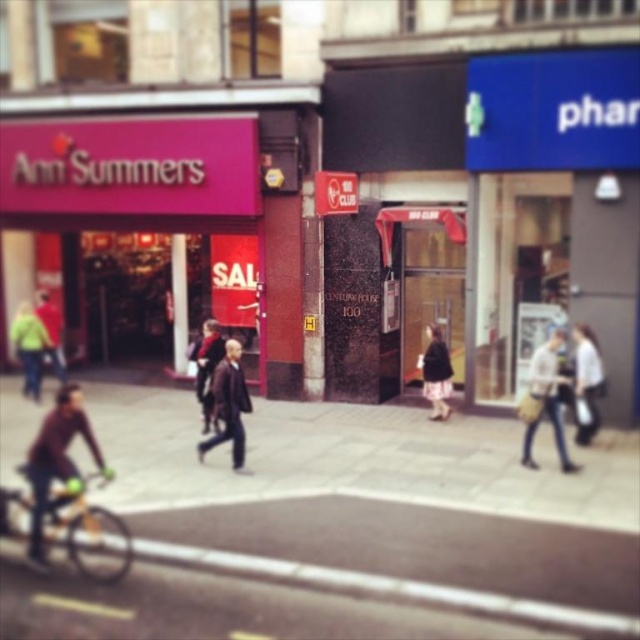
Which is more to the right, smooth concrete pavement at center or green fabric jacket at left?

From the viewer's perspective, smooth concrete pavement at center appears more on the right side.

Who is more forward, (56,616) or (35,328)?

Point (56,616) is more forward.

Is point (497, 577) positioned after point (24, 314)?

No, (497, 577) is closer to viewer.

Where is `smooth concrete pavement at center`? The image size is (640, 640). smooth concrete pavement at center is located at coordinates (346, 529).

Can you confirm if matte brown jacket at lower left is wider than white fabric bag at center?

Correct, the width of matte brown jacket at lower left exceeds that of white fabric bag at center.

Describe the element at coordinates (58, 460) in the screenshot. I see `matte brown jacket at lower left` at that location.

You are a GUI agent. You are given a task and a screenshot of the screen. Output one action in this format:
    pyautogui.click(x=<x>, y=<y>)
    Task: Click on the matte brown jacket at lower left
    Image resolution: width=640 pixels, height=640 pixels.
    Given the screenshot: What is the action you would take?
    pyautogui.click(x=58, y=460)

Which is more to the right, white fabric bag at center or matte black jacket at center?

Positioned to the right is white fabric bag at center.

Which is below, white fabric bag at center or matte black jacket at center?

white fabric bag at center

Is point (582, 344) positioned behind point (52, 352)?

No.

Where is `white fabric bag at center`? The width and height of the screenshot is (640, 640). white fabric bag at center is located at coordinates (588, 378).